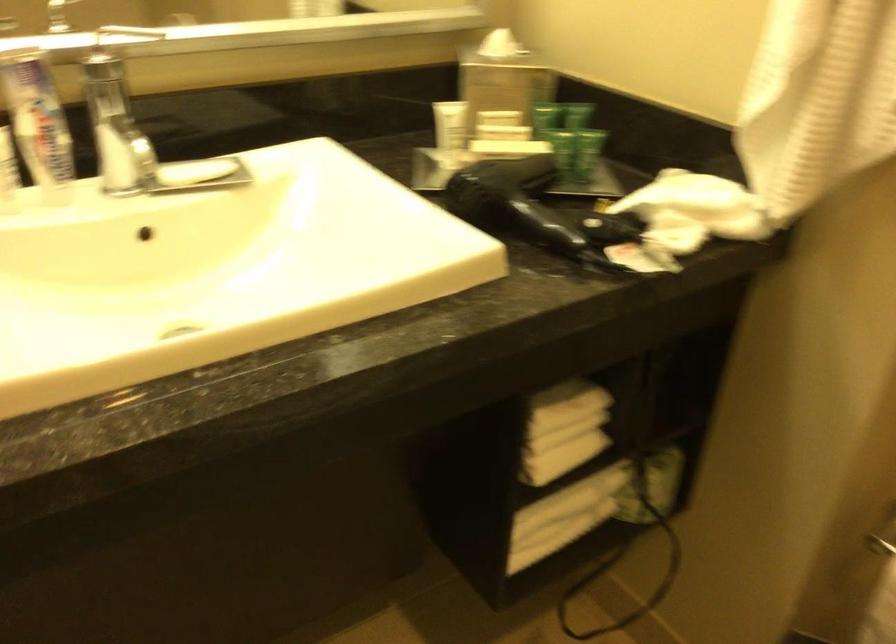
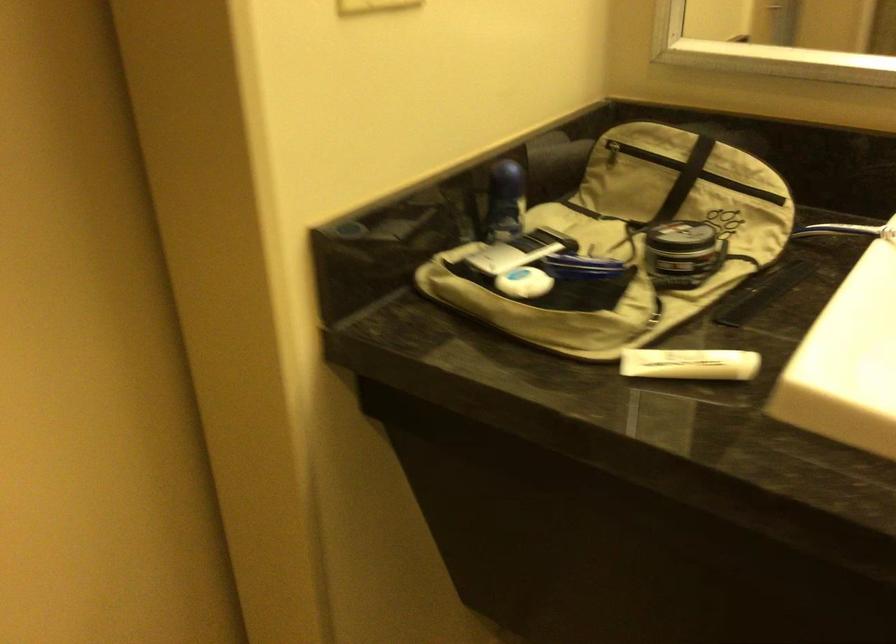
Question: The images are taken continuously from a first-person perspective. In which direction is your viewpoint rotating?

Choices:
 (A) Left
 (B) Right
 (C) Up
 (D) Down

Answer: (A)